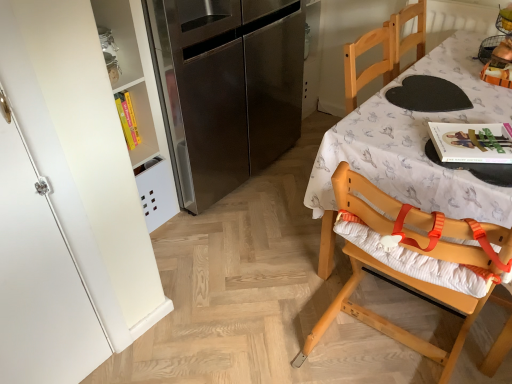
Question: Should I look upward or downward to see stainless steel refrigerator at left?

Choices:
 (A) up
 (B) down

Answer: (A)

Question: Is white matte cabinet at left bigger than stainless steel refrigerator at left?

Choices:
 (A) no
 (B) yes

Answer: (A)

Question: From the image's perspective, would you say white matte cabinet at left is positioned over stainless steel refrigerator at left?

Choices:
 (A) yes
 (B) no

Answer: (B)

Question: Considering the relative sizes of white matte cabinet at left and stainless steel refrigerator at left in the image provided, is white matte cabinet at left shorter than stainless steel refrigerator at left?

Choices:
 (A) no
 (B) yes

Answer: (A)

Question: Is white matte cabinet at left not close to stainless steel refrigerator at left?

Choices:
 (A) yes
 (B) no

Answer: (B)

Question: Considering the relative positions of white matte cabinet at left and stainless steel refrigerator at left in the image provided, is white matte cabinet at left to the right of stainless steel refrigerator at left from the viewer's perspective?

Choices:
 (A) no
 (B) yes

Answer: (A)

Question: From a real-world perspective, is white matte cabinet at left physically below stainless steel refrigerator at left?

Choices:
 (A) no
 (B) yes

Answer: (B)

Question: Can you confirm if wooden highchair at right is positioned to the right of wooden chair at right?

Choices:
 (A) no
 (B) yes

Answer: (A)

Question: Is wooden highchair at right taller than wooden chair at right?

Choices:
 (A) no
 (B) yes

Answer: (A)

Question: From the image's perspective, would you say wooden highchair at right is positioned over wooden chair at right?

Choices:
 (A) no
 (B) yes

Answer: (A)

Question: From a real-world perspective, is wooden highchair at right physically above wooden chair at right?

Choices:
 (A) no
 (B) yes

Answer: (A)

Question: Is wooden highchair at right oriented away from wooden chair at right?

Choices:
 (A) yes
 (B) no

Answer: (B)

Question: From the image's perspective, is wooden highchair at right below wooden chair at right?

Choices:
 (A) yes
 (B) no

Answer: (A)

Question: Is white matte cabinet at left bigger than wooden highchair at right?

Choices:
 (A) yes
 (B) no

Answer: (B)